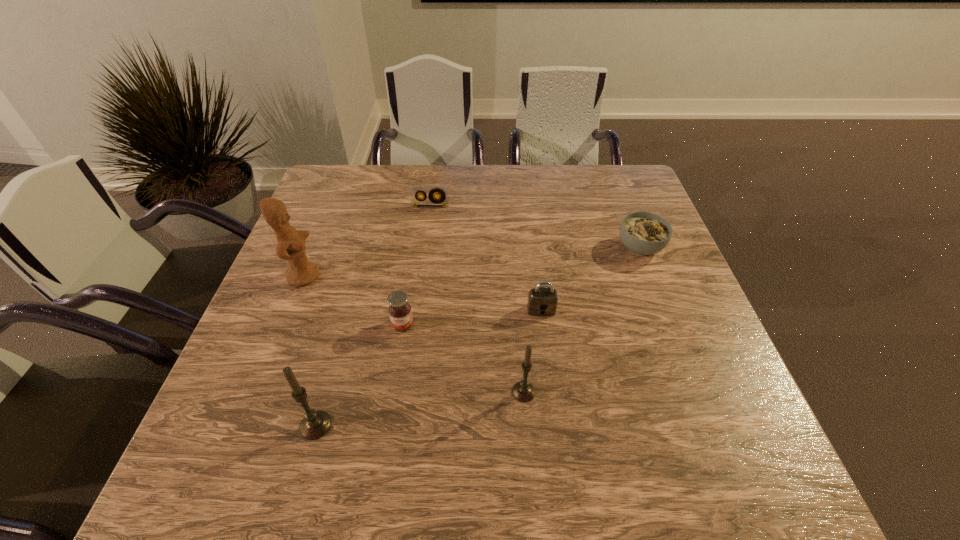
Please point a vacant point for placing a candle on the right. Please provide its 2D coordinates. Your answer should be formatted as a tuple, i.e. [(x, y)], where the tuple contains the x and y coordinates of a point satisfying the conditions above.

[(708, 362)]